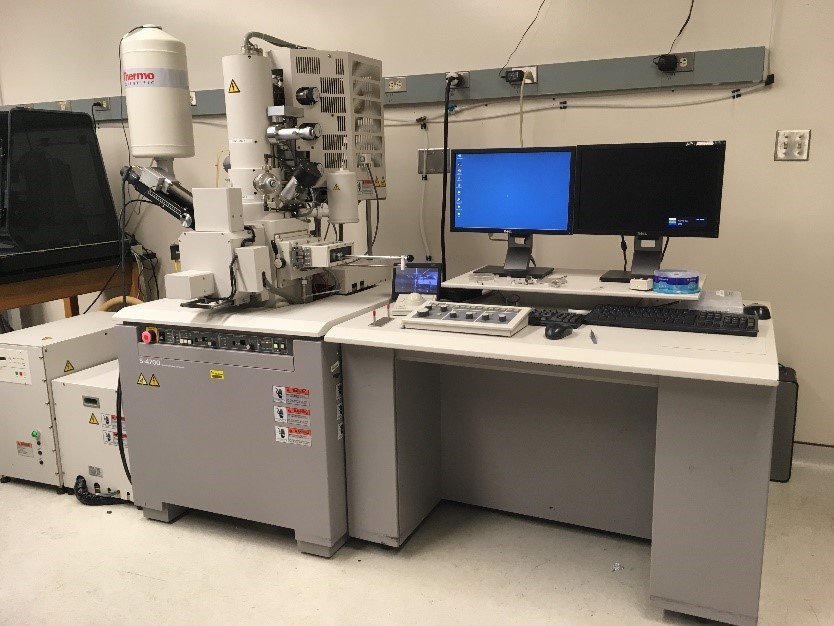
Find the location of a particular element. This screenshot has width=834, height=626. mouse is located at coordinates (553, 330).